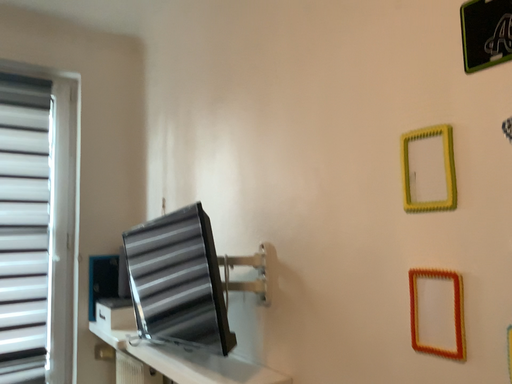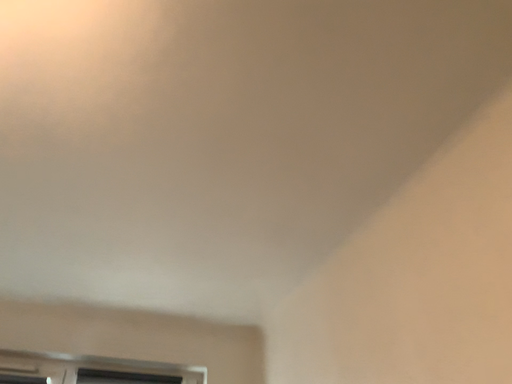
Question: Which way did the camera rotate in the video?

Choices:
 (A) rotated left
 (B) rotated right

Answer: (A)